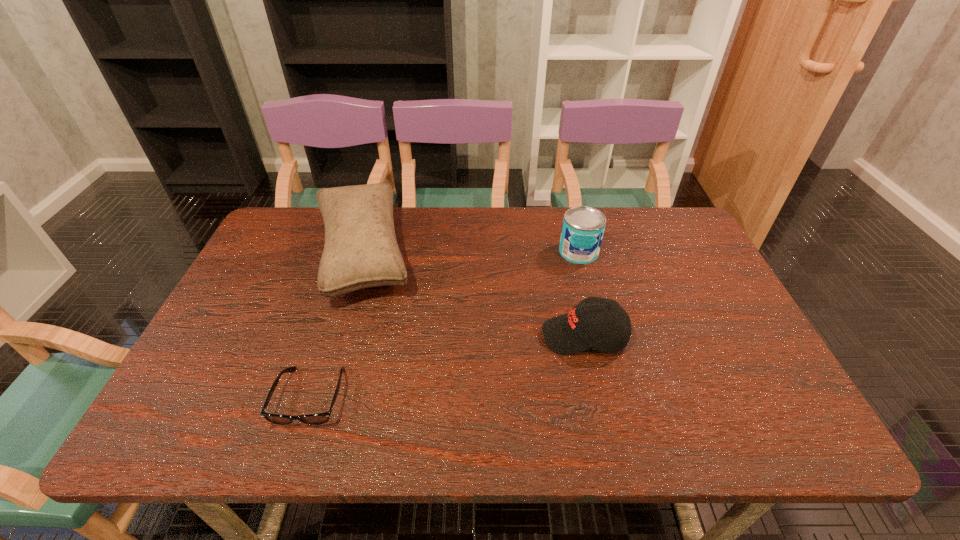
Where is `free space located on the front-facing side of the third tallest object`? The image size is (960, 540). free space located on the front-facing side of the third tallest object is located at coordinates (510, 336).

Locate an element on the screen. The image size is (960, 540). cushion that is positioned at the far edge is located at coordinates click(x=361, y=251).

Find the location of a particular element. can present at the far edge is located at coordinates (583, 227).

Locate an element on the screen. Image resolution: width=960 pixels, height=540 pixels. object that is at the near edge is located at coordinates (312, 419).

The image size is (960, 540). Find the location of `object positioned at the left edge`. object positioned at the left edge is located at coordinates (361, 251).

The height and width of the screenshot is (540, 960). I want to click on object that is at the far left corner, so click(361, 251).

You are a GUI agent. You are given a task and a screenshot of the screen. Output one action in this format:
    pyautogui.click(x=<x>, y=<y>)
    Task: Click on the free region at the far edge of the desktop
    Image resolution: width=960 pixels, height=540 pixels.
    Given the screenshot: What is the action you would take?
    pyautogui.click(x=540, y=245)

Identify the location of vacant region at the far left corner of the desktop. The height and width of the screenshot is (540, 960). (320, 216).

This screenshot has height=540, width=960. I want to click on vacant space at the far right corner of the desktop, so coord(637,207).

Where is `vacant area that lies between the third tallest object and the tallest object`? vacant area that lies between the third tallest object and the tallest object is located at coordinates (473, 295).